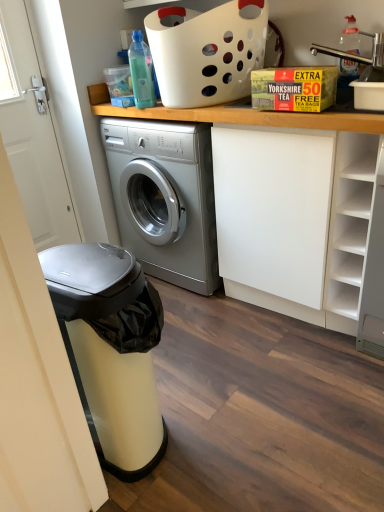
Find the location of a particular element. unoccupied space behind metallic stainless steel dishwasher at left is located at coordinates (180, 359).